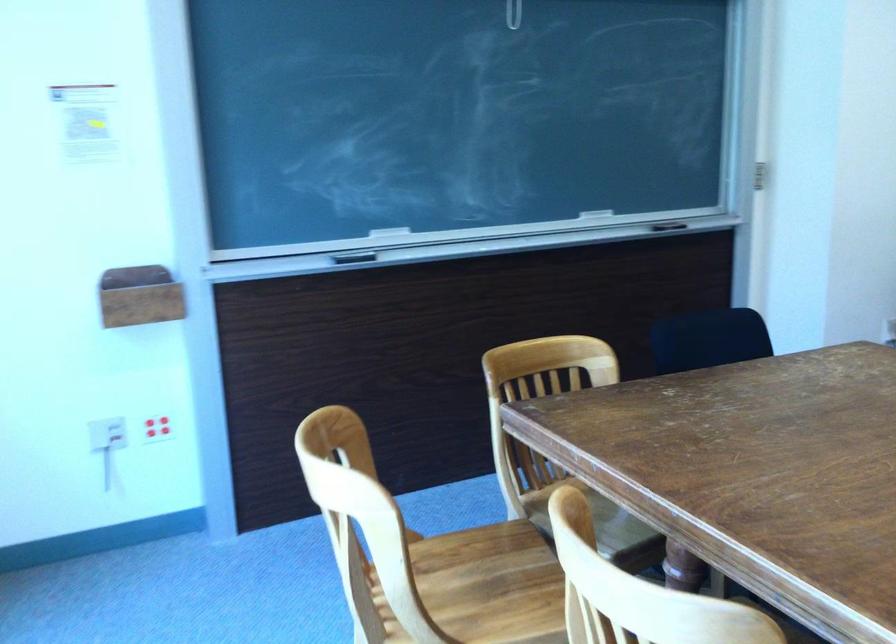
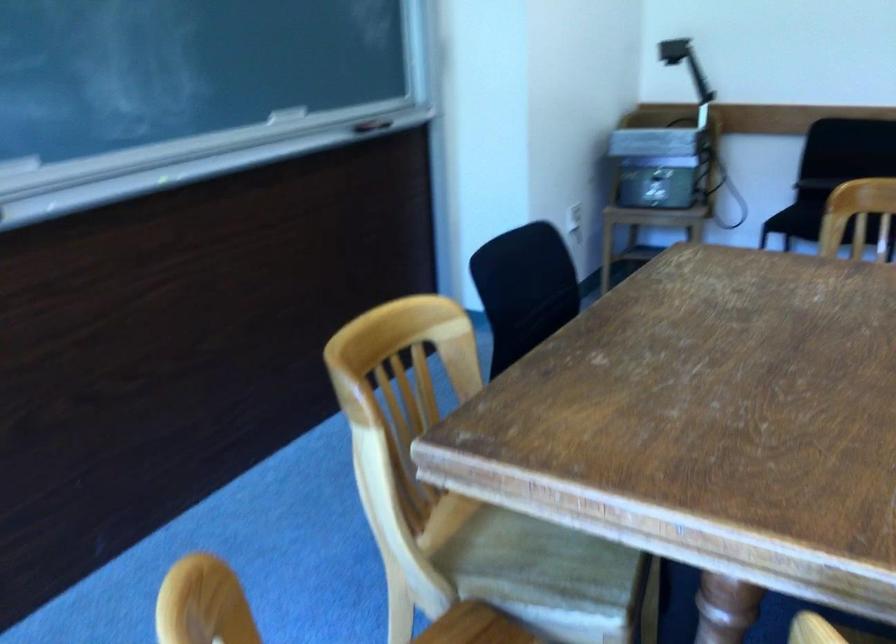
Find the pixel in the second image that matches [596,520] in the first image.

(528, 556)